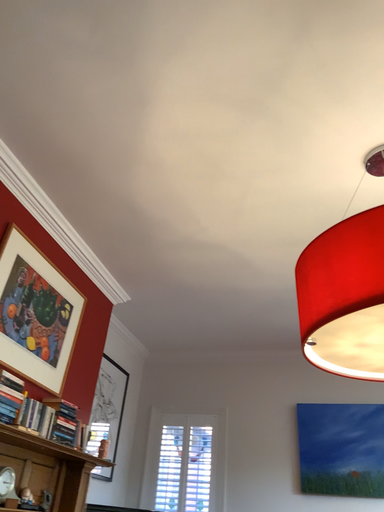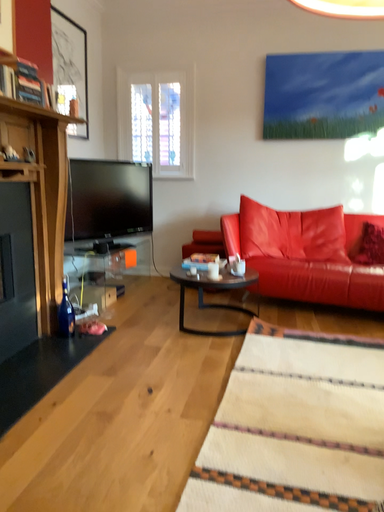
Question: Which way did the camera rotate in the video?

Choices:
 (A) rotated downward
 (B) rotated upward

Answer: (A)